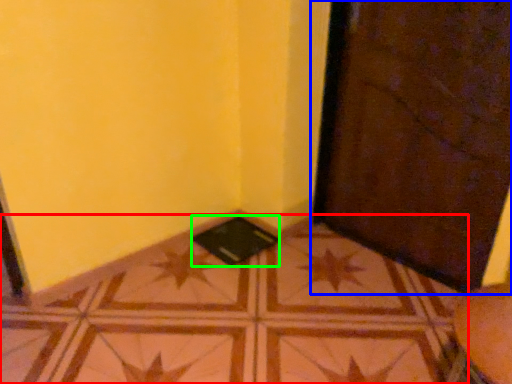
Question: Which object is the closest to the tile (highlighted by a red box)? Choose among these: door (highlighted by a blue box) or pad (highlighted by a green box).

Choices:
 (A) door
 (B) pad

Answer: (B)